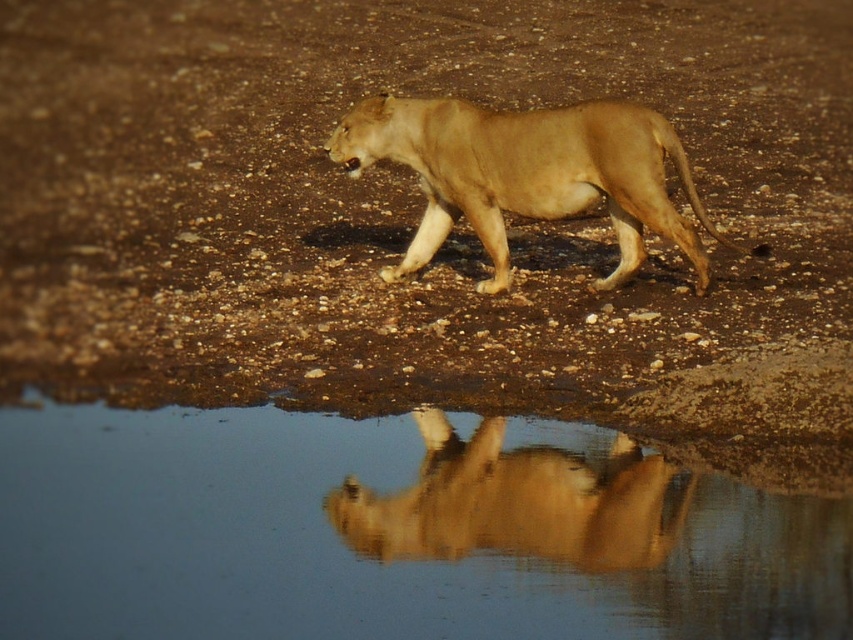
Who is lower down, golden fur lion at center or golden fur lioness at center?

golden fur lioness at center is lower down.

This screenshot has width=853, height=640. I want to click on golden fur lion at center, so tap(527, 173).

Which is behind, point (444, 192) or point (421, 500)?

Positioned behind is point (444, 192).

This screenshot has width=853, height=640. I want to click on golden fur lion at center, so click(527, 173).

Is point (595, 541) in front of point (396, 113)?

Yes, it is in front of point (396, 113).

Image resolution: width=853 pixels, height=640 pixels. Identify the location of clear water at reflection center. (393, 531).

Image resolution: width=853 pixels, height=640 pixels. Identify the location of clear water at reflection center. (393, 531).

Which is in front, point (711, 573) or point (643, 461)?

Point (711, 573) is more forward.

Is clear water at reflection center to the left of golden fur lioness at center from the viewer's perspective?

Yes, clear water at reflection center is to the left of golden fur lioness at center.

Is point (445, 509) less distant than point (653, 484)?

Yes, point (445, 509) is closer to viewer.

Identify the location of clear water at reflection center. The width and height of the screenshot is (853, 640). (393, 531).